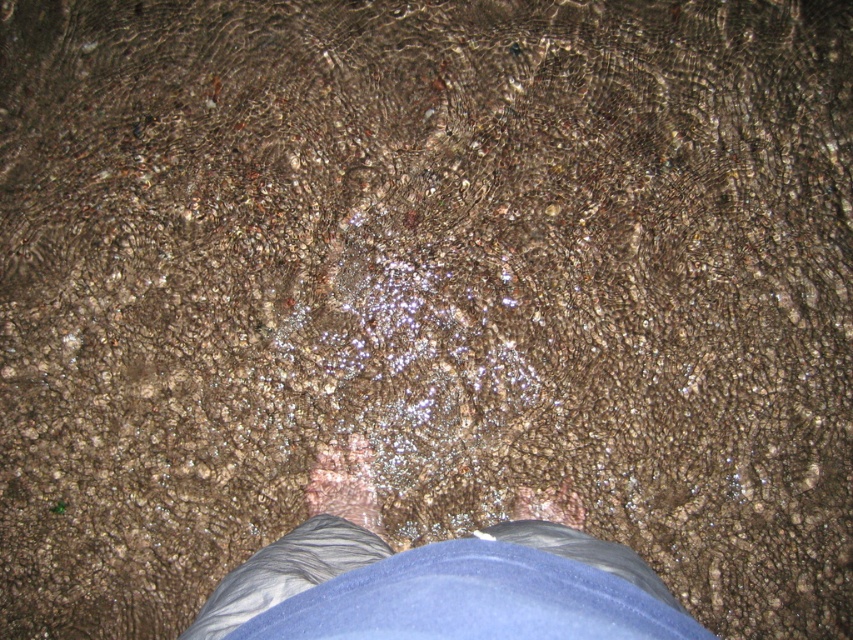
Question: Which of the following is the closest to the observer?

Choices:
 (A) matte skin foot at center
 (B) matte brown skin at center

Answer: (A)

Question: Which of the following is the farthest from the observer?

Choices:
 (A) matte brown skin at center
 (B) matte skin foot at center

Answer: (A)

Question: Which object appears farthest from the camera in this image?

Choices:
 (A) matte skin foot at center
 (B) gray fabric pants at center
 (C) matte brown skin at center

Answer: (C)

Question: Considering the relative positions of matte skin foot at center and matte brown skin at center in the image provided, where is matte skin foot at center located with respect to matte brown skin at center?

Choices:
 (A) right
 (B) left

Answer: (B)

Question: Can you confirm if gray fabric pants at center is positioned to the left of matte skin foot at center?

Choices:
 (A) yes
 (B) no

Answer: (B)

Question: Can you confirm if gray fabric pants at center is smaller than matte brown skin at center?

Choices:
 (A) yes
 (B) no

Answer: (B)